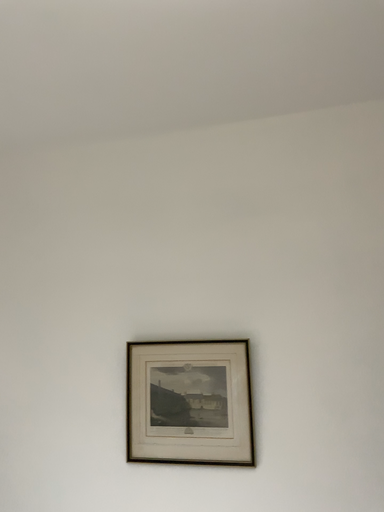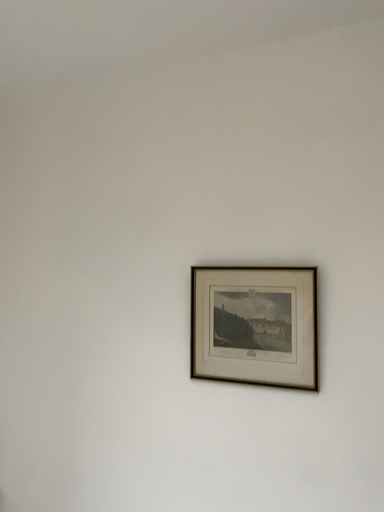
Question: Which way did the camera rotate in the video?

Choices:
 (A) rotated downward
 (B) rotated upward

Answer: (A)